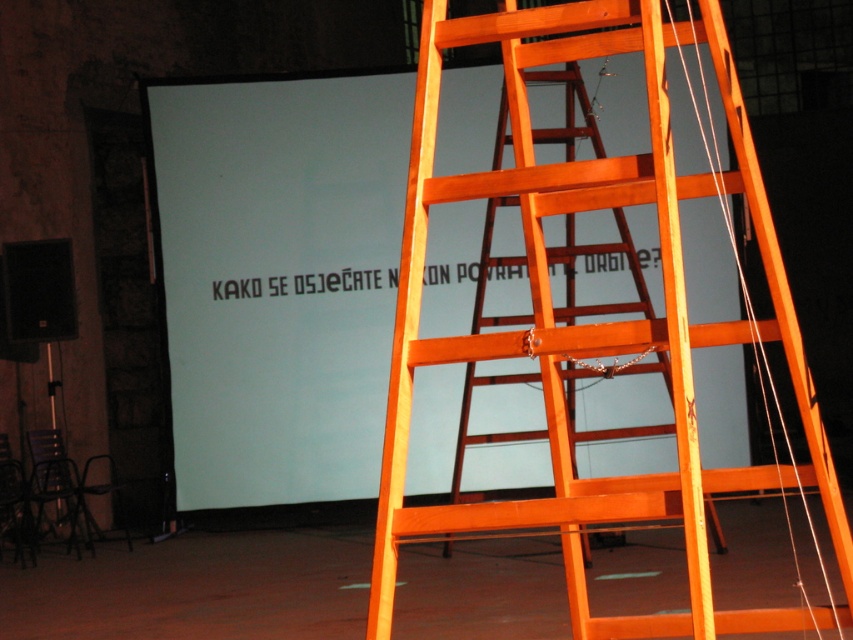
Which of these two, white matte projection screen at upper left or orange wood ladder at center, stands taller?

orange wood ladder at center is taller.

Between white matte projection screen at upper left and orange wood ladder at center, which one has less height?

With less height is white matte projection screen at upper left.

Does point (254, 461) come closer to viewer compared to point (438, 509)?

No, (254, 461) is behind (438, 509).

I want to click on white matte projection screen at upper left, so point(279,280).

Is white matte projection screen at upper left to the left of orange wooden ladder at center from the viewer's perspective?

Correct, you'll find white matte projection screen at upper left to the left of orange wooden ladder at center.

Is point (238, 83) positioned after point (601, 252)?

Yes.

Locate an element on the screen. The height and width of the screenshot is (640, 853). white matte projection screen at upper left is located at coordinates (279, 280).

In the scene shown: Between orange wood ladder at center and orange wooden ladder at center, which one is positioned lower?

Positioned lower is orange wood ladder at center.

Can you confirm if orange wood ladder at center is bigger than orange wooden ladder at center?

Yes.

In the scene shown: Who is more distant from viewer, [543,61] or [500,316]?

Positioned behind is point [500,316].

Where is `orange wood ladder at center`? orange wood ladder at center is located at coordinates (596, 323).